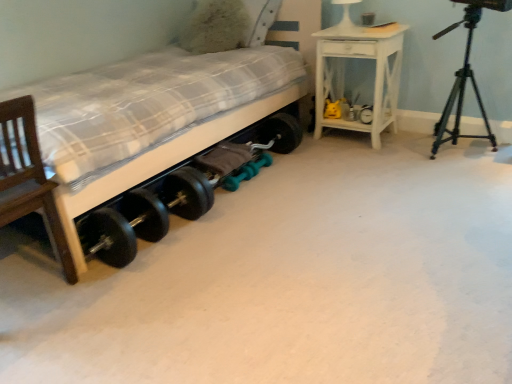
You are a GUI agent. You are given a task and a screenshot of the screen. Output one action in this format:
    pyautogui.click(x=<x>, y=<y>)
    Task: Click on the free point below black metal tripod at right (from a real-world perspective)
    This screenshot has width=512, height=384.
    Given the screenshot: What is the action you would take?
    click(460, 154)